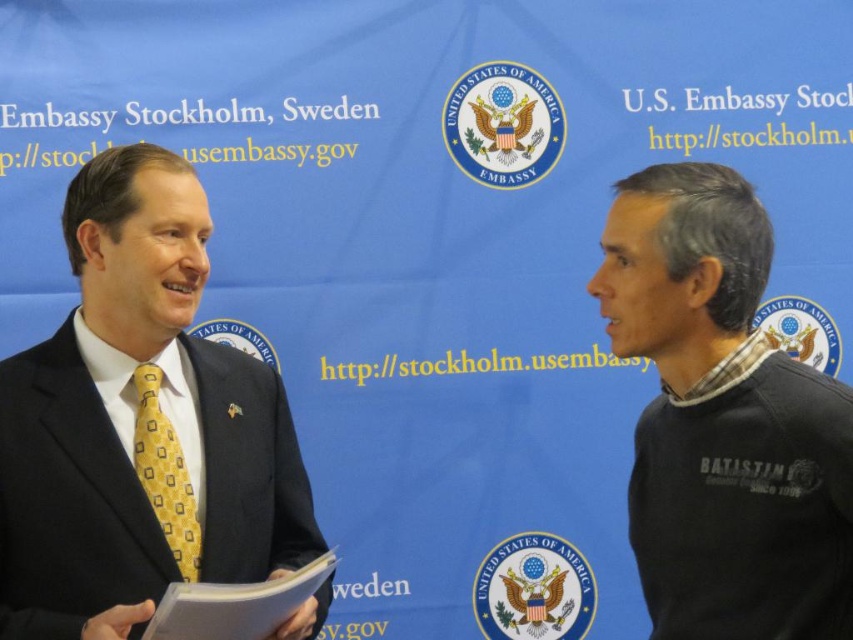
Which is below, dark gray sweater at right or yellow silk tie at left?

Positioned lower is yellow silk tie at left.

Is dark gray sweater at right taller than yellow silk tie at left?

Yes.

In order to click on dark gray sweater at right in this screenshot , I will do `click(723, 420)`.

Who is more forward, (289, 550) or (165, 442)?

Point (165, 442) is in front.

Is matte black suit at left smaller than yellow silk tie at left?

Incorrect, matte black suit at left is not smaller in size than yellow silk tie at left.

Image resolution: width=853 pixels, height=640 pixels. What do you see at coordinates (138, 424) in the screenshot?
I see `matte black suit at left` at bounding box center [138, 424].

The height and width of the screenshot is (640, 853). In order to click on matte black suit at left in this screenshot , I will do `click(138, 424)`.

Is matte black suit at left in front of dark gray sweater at right?

Yes, matte black suit at left is closer to the viewer.

Which of these two, matte black suit at left or dark gray sweater at right, stands shorter?

With less height is dark gray sweater at right.

Is point (309, 520) more distant than point (643, 268)?

Yes, point (309, 520) is farther from viewer.

You are a GUI agent. You are given a task and a screenshot of the screen. Output one action in this format:
    pyautogui.click(x=<x>, y=<y>)
    Task: Click on the matte black suit at left
    
    Given the screenshot: What is the action you would take?
    pyautogui.click(x=138, y=424)